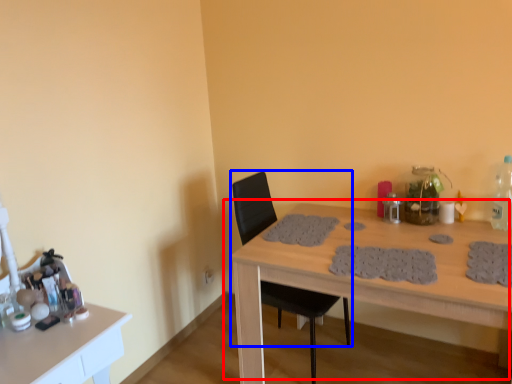
Question: Which point is further to the camera, table (highlighted by a red box) or chair (highlighted by a blue box)?

Choices:
 (A) table
 (B) chair

Answer: (B)